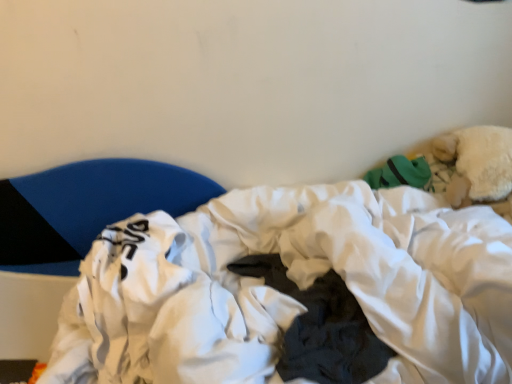
I want to click on blue fabric pillow at left, so click(x=86, y=208).

What is the approximate height of blue fabric pillow at left?

14.41 inches.

The image size is (512, 384). What do you see at coordinates (86, 208) in the screenshot?
I see `blue fabric pillow at left` at bounding box center [86, 208].

Describe the element at coordinates (290, 281) in the screenshot. This screenshot has width=512, height=384. I see `white soft fabric at center` at that location.

Identify the location of white soft fabric at center. (290, 281).

Locate an element on the screen. This screenshot has width=512, height=384. blue fabric pillow at left is located at coordinates (86, 208).

Consider the image. Which is more to the right, white soft fabric at center or blue fabric pillow at left?

white soft fabric at center is more to the right.

Does white soft fabric at center come behind blue fabric pillow at left?

No, white soft fabric at center is closer to the camera.

Is point (409, 211) closer or farther from the camera than point (103, 160)?

Point (409, 211) is closer to the camera than point (103, 160).

From the image's perspective, is white soft fabric at center located above or below blue fabric pillow at left?

white soft fabric at center is below blue fabric pillow at left.

From a real-world perspective, is white soft fabric at center physically located above or below blue fabric pillow at left?

In terms of real-world spatial position, white soft fabric at center is below blue fabric pillow at left.

Is white soft fabric at center wider than blue fabric pillow at left?

Indeed, white soft fabric at center has a greater width compared to blue fabric pillow at left.

Can you confirm if white soft fabric at center is shorter than blue fabric pillow at left?

In fact, white soft fabric at center may be taller than blue fabric pillow at left.

Considering the sizes of white soft fabric at center and blue fabric pillow at left in the image, is white soft fabric at center bigger or smaller than blue fabric pillow at left?

white soft fabric at center is bigger than blue fabric pillow at left.

Can blue fabric pillow at left be found inside white soft fabric at center?

No.

Consider the image. Is white soft fabric at center not close to blue fabric pillow at left?

No.

Looking at this image, is white soft fabric at center oriented away from blue fabric pillow at left?

Correct, white soft fabric at center is looking away from blue fabric pillow at left.

Can you tell me how much white soft fabric at center and blue fabric pillow at left differ in facing direction?

The angle between the facing direction of white soft fabric at center and the facing direction of blue fabric pillow at left is 2.15 degrees.

The image size is (512, 384). I want to click on furniture above the white soft fabric at center (from the image's perspective), so click(x=86, y=208).

Is blue fabric pillow at left to the left or to the right of white soft fabric at center in the image?

In the image, blue fabric pillow at left appears on the left side of white soft fabric at center.

Who is more distant, blue fabric pillow at left or white soft fabric at center?

blue fabric pillow at left is further from the camera.

Considering the positions of point (150, 167) and point (345, 209), is point (150, 167) closer or farther from the camera than point (345, 209)?

Point (150, 167) is farther from the camera than point (345, 209).

From the image's perspective, which object appears higher, blue fabric pillow at left or white soft fabric at center?

From the image's view, blue fabric pillow at left is above.

From a real-world perspective, does blue fabric pillow at left sit lower than white soft fabric at center?

No.

Does blue fabric pillow at left have a lesser width compared to white soft fabric at center?

Yes, blue fabric pillow at left is thinner than white soft fabric at center.

Between blue fabric pillow at left and white soft fabric at center, which one has more height?

Standing taller between the two is white soft fabric at center.

Considering the sizes of blue fabric pillow at left and white soft fabric at center in the image, is blue fabric pillow at left bigger or smaller than white soft fabric at center?

In the image, blue fabric pillow at left appears to be smaller than white soft fabric at center.

Is blue fabric pillow at left completely or partially outside of white soft fabric at center?

Yes, blue fabric pillow at left is located beyond the bounds of white soft fabric at center.

Is there a large distance between blue fabric pillow at left and white soft fabric at center?

Actually, blue fabric pillow at left and white soft fabric at center are a little close together.

Is blue fabric pillow at left facing away from white soft fabric at center?

No, white soft fabric at center is not at the back of blue fabric pillow at left.

There is a white soft fabric at center. Identify the location of furniture above it (from a real-world perspective). The image size is (512, 384). (86, 208).

Locate an element on the screen. The width and height of the screenshot is (512, 384). hospital bed that is on the right side of blue fabric pillow at left is located at coordinates (290, 281).

The height and width of the screenshot is (384, 512). I want to click on hospital bed that is under the blue fabric pillow at left (from a real-world perspective), so click(x=290, y=281).